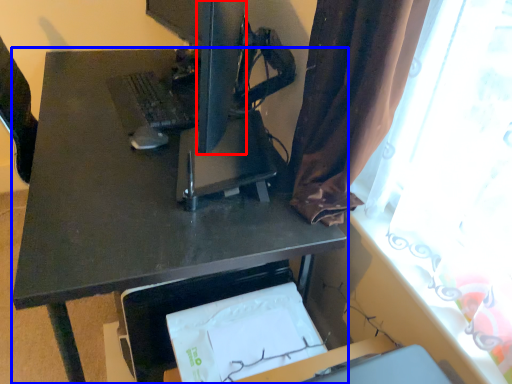
Question: Which object is further to the camera taking this photo, computer monitor (highlighted by a red box) or desk (highlighted by a blue box)?

Choices:
 (A) computer monitor
 (B) desk

Answer: (B)